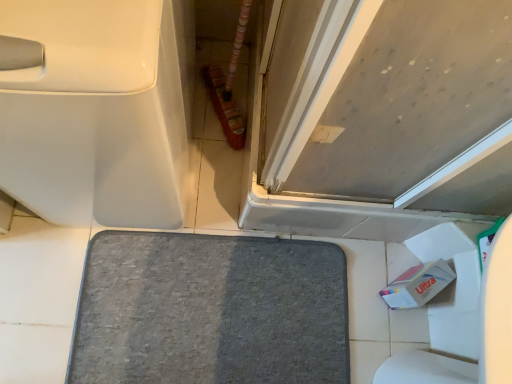
What do you see at coordinates (210, 311) in the screenshot? I see `gray soft carpet at center` at bounding box center [210, 311].

Locate an element on the screen. The width and height of the screenshot is (512, 384). gray soft carpet at center is located at coordinates (210, 311).

At what (x,y) coordinates should I click in order to perform the action: click on gray soft carpet at center. Please return your answer as a coordinate pair (x, y). Looking at the image, I should click on (210, 311).

Find the location of a particular element. toilet on the left of the matte gray door at upper right is located at coordinates (99, 111).

Which of these two, matte gray door at upper right or white glossy toilet at left, stands shorter?

matte gray door at upper right is shorter.

Is white glossy toilet at left located within matte gray door at upper right?

No, white glossy toilet at left is located outside of matte gray door at upper right.

In the scene shown: Can you confirm if matte gray door at upper right is wider than white glossy toilet at left?

Incorrect, the width of matte gray door at upper right does not surpass that of white glossy toilet at left.

Is there a large distance between matte gray door at upper right and gray soft carpet at center?

matte gray door at upper right is near gray soft carpet at center, not far away.

Between matte gray door at upper right and gray soft carpet at center, which one has more height?

matte gray door at upper right.

Considering the positions of objects matte gray door at upper right and gray soft carpet at center in the image provided, who is more to the right, matte gray door at upper right or gray soft carpet at center?

matte gray door at upper right is more to the right.

In terms of size, does gray soft carpet at center appear bigger or smaller than white glossy toilet at left?

gray soft carpet at center is smaller than white glossy toilet at left.

Identify the location of bath mat on the right of white glossy toilet at left. (210, 311).

Between gray soft carpet at center and white glossy toilet at left, which one appears on the left side from the viewer's perspective?

white glossy toilet at left.

Could you tell me if gray soft carpet at center is turned towards white glossy toilet at left?

No, gray soft carpet at center does not turn towards white glossy toilet at left.

Considering the positions of objects gray soft carpet at center and matte gray door at upper right in the image provided, who is in front, gray soft carpet at center or matte gray door at upper right?

Positioned in front is matte gray door at upper right.

Visually, is gray soft carpet at center positioned to the left or to the right of matte gray door at upper right?

Clearly, gray soft carpet at center is on the left of matte gray door at upper right in the image.

Looking at this image, from their relative heights in the image, would you say gray soft carpet at center is taller or shorter than matte gray door at upper right?

In the image, gray soft carpet at center appears to be shorter than matte gray door at upper right.

From the picture: What's the angular difference between gray soft carpet at center and matte gray door at upper right's facing directions?

There is a 4.77-degree angle between the facing directions of gray soft carpet at center and matte gray door at upper right.

From the image's perspective, is white glossy toilet at left on top of matte gray door at upper right?

Indeed, from the image's perspective, white glossy toilet at left is shown above matte gray door at upper right.

Does white glossy toilet at left touch matte gray door at upper right?

There is a gap between white glossy toilet at left and matte gray door at upper right.

Is white glossy toilet at left facing away from matte gray door at upper right?

white glossy toilet at left is not turned away from matte gray door at upper right.

Measure the distance from white glossy toilet at left to gray soft carpet at center.

The distance of white glossy toilet at left from gray soft carpet at center is 17.70 inches.

Based on their sizes in the image, would you say white glossy toilet at left is bigger or smaller than gray soft carpet at center?

Considering their sizes, white glossy toilet at left takes up more space than gray soft carpet at center.

Would you consider white glossy toilet at left to be distant from gray soft carpet at center?

No, there isn't a large distance between white glossy toilet at left and gray soft carpet at center.

Considering the positions of points (166, 107) and (104, 269), is point (166, 107) closer to camera compared to point (104, 269)?

Yes, point (166, 107) is closer to viewer.

Find the location of a particular element. door above the white glossy toilet at left (from a real-world perspective) is located at coordinates (385, 118).

Identify the location of door that appears above the gray soft carpet at center (from the image's perspective). Image resolution: width=512 pixels, height=384 pixels. (385, 118).

Estimate the real-world distances between objects in this image. Which object is further from white glossy toilet at left, matte gray door at upper right or gray soft carpet at center?

Based on the image, gray soft carpet at center appears to be further to white glossy toilet at left.

Consider the image. Looking at the image, which one is located closer to white glossy toilet at left, gray soft carpet at center or matte gray door at upper right?

Answer: matte gray door at upper right is closer to white glossy toilet at left.

Considering their positions, is white glossy toilet at left positioned closer to matte gray door at upper right than gray soft carpet at center?

white glossy toilet at left is positioned closer to the anchor matte gray door at upper right.

Considering their positions, is gray soft carpet at center positioned closer to matte gray door at upper right than white glossy toilet at left?

The object closer to matte gray door at upper right is white glossy toilet at left.

Estimate the real-world distances between objects in this image. Which object is closer to gray soft carpet at center, matte gray door at upper right or white glossy toilet at left?

matte gray door at upper right.

Which object lies further to the anchor point gray soft carpet at center, white glossy toilet at left or matte gray door at upper right?

white glossy toilet at left is positioned further to the anchor gray soft carpet at center.

This screenshot has height=384, width=512. Identify the location of toilet positioned between matte gray door at upper right and gray soft carpet at center from near to far. (99, 111).